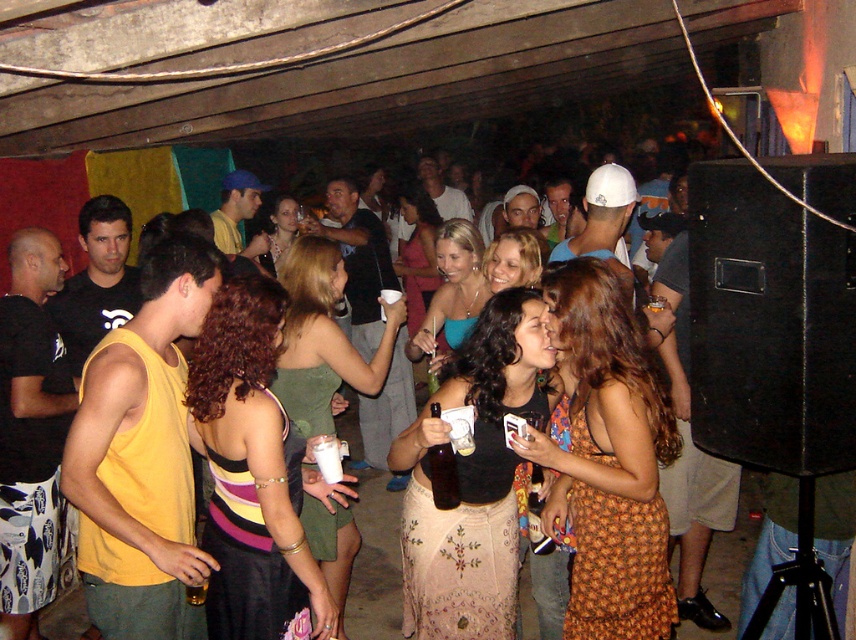
Consider the image. You are a photographer at the party and want to take a group photo of the matte pink dress at center and the matte green dress at center. The camera you are using has a minimum focus distance of 1 meter. Will you be able to capture both dresses in focus at the same time?

The matte pink dress at center and matte green dress at center are 91.97 centimeters apart. Since the minimum focus distance of the camera is 1 meter, the distance between them is less than required. Therefore, you may not be able to capture both dresses in focus simultaneously.